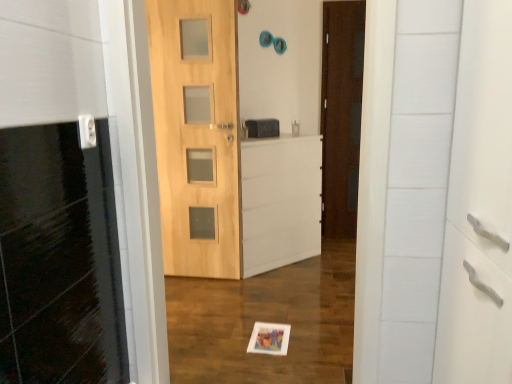
Question: Considering the relative sizes of natural wood door at center, marked as the 2th door in a right-to-left arrangement, and matte black medicine cabinet at center in the image provided, is natural wood door at center, marked as the 2th door in a right-to-left arrangement, bigger than matte black medicine cabinet at center?

Choices:
 (A) no
 (B) yes

Answer: (B)

Question: Is natural wood door at center, marked as the 2th door in a right-to-left arrangement, positioned beyond the bounds of matte black medicine cabinet at center?

Choices:
 (A) no
 (B) yes

Answer: (B)

Question: Is natural wood door at center, which is counted as the 1th door, starting from the front, at the right side of matte black medicine cabinet at center?

Choices:
 (A) yes
 (B) no

Answer: (B)

Question: Is natural wood door at center, the 2th door from the back, taller than matte black medicine cabinet at center?

Choices:
 (A) yes
 (B) no

Answer: (A)

Question: Is natural wood door at center, marked as the 2th door in a right-to-left arrangement, beside matte black medicine cabinet at center?

Choices:
 (A) yes
 (B) no

Answer: (B)

Question: Is natural wood door at center, which is counted as the 1th door, starting from the front, inside the boundaries of dark brown wood door at center, which ranks as the first door in back-to-front order, or outside?

Choices:
 (A) inside
 (B) outside

Answer: (B)

Question: From their relative heights in the image, would you say natural wood door at center, the 2th door from the back, is taller or shorter than dark brown wood door at center, which ranks as the first door in back-to-front order?

Choices:
 (A) tall
 (B) short

Answer: (B)

Question: Based on their sizes in the image, would you say natural wood door at center, which is counted as the 1th door, starting from the front, is bigger or smaller than dark brown wood door at center, arranged as the 2th door when viewed from the left?

Choices:
 (A) big
 (B) small

Answer: (A)

Question: Considering the relative positions of natural wood door at center, the 2th door from the back, and dark brown wood door at center, arranged as the 2th door when viewed from the left, in the image provided, is natural wood door at center, the 2th door from the back, to the left or to the right of dark brown wood door at center, arranged as the 2th door when viewed from the left,?

Choices:
 (A) right
 (B) left

Answer: (B)

Question: Considering their positions, is matte black medicine cabinet at center located in front of or behind white plastic electric outlet at upper left?

Choices:
 (A) behind
 (B) front

Answer: (A)

Question: Is matte black medicine cabinet at center taller or shorter than white plastic electric outlet at upper left?

Choices:
 (A) short
 (B) tall

Answer: (B)

Question: Which is correct: matte black medicine cabinet at center is inside white plastic electric outlet at upper left, or outside of it?

Choices:
 (A) outside
 (B) inside

Answer: (A)

Question: Is matte black medicine cabinet at center to the left or to the right of white plastic electric outlet at upper left in the image?

Choices:
 (A) left
 (B) right

Answer: (B)

Question: In the image, is white matte file cabinet at center positioned in front of or behind matte black medicine cabinet at center?

Choices:
 (A) front
 (B) behind

Answer: (A)

Question: In terms of width, does white matte file cabinet at center look wider or thinner when compared to matte black medicine cabinet at center?

Choices:
 (A) wide
 (B) thin

Answer: (A)